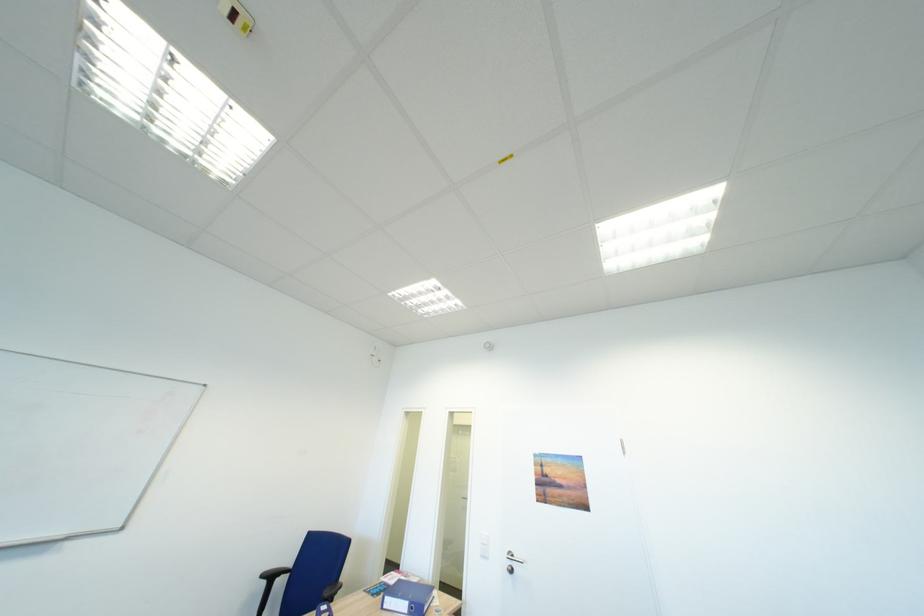
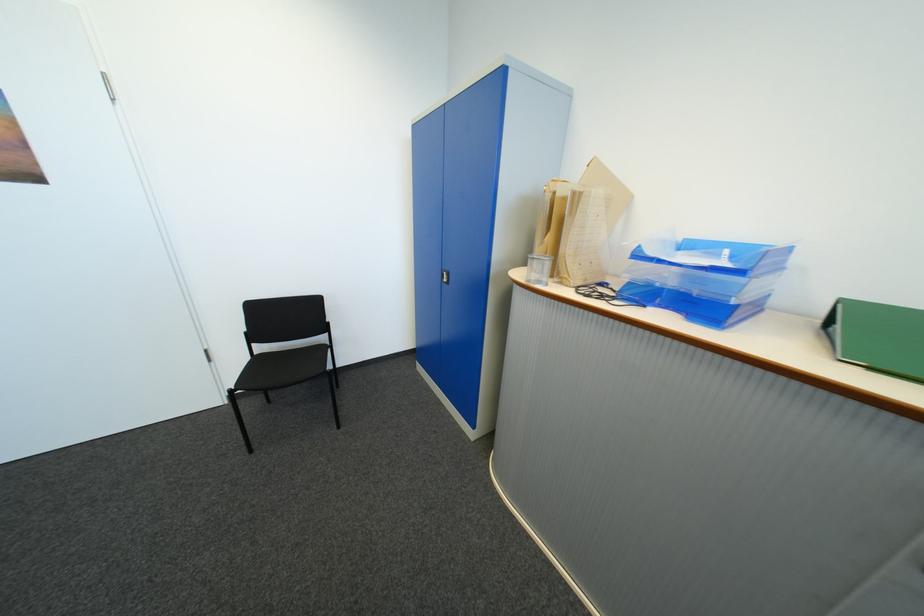
Based on the continuous images, in which direction is the camera rotating?

The rotation direction of the camera is right-down.